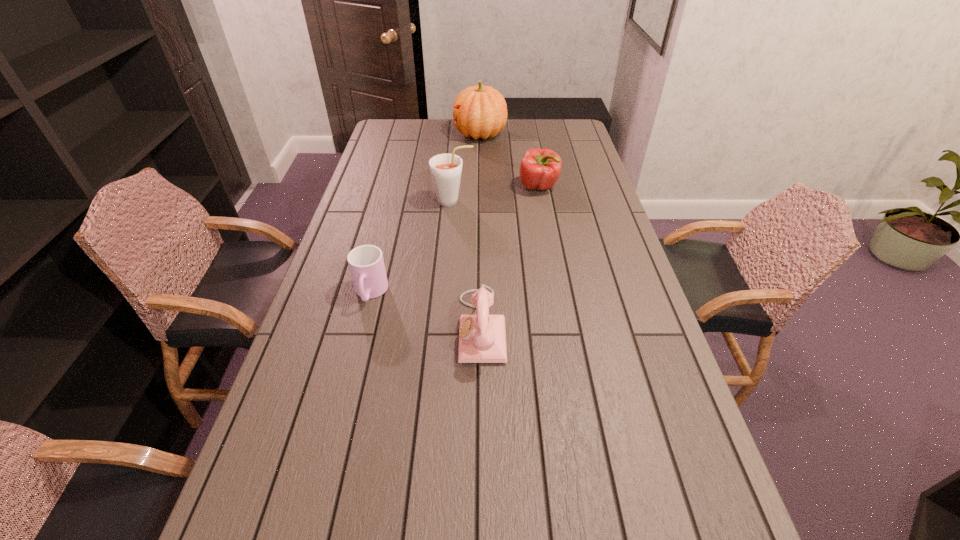
The width and height of the screenshot is (960, 540). In the image, there is a desktop. Find the location of `vacant space at the left edge`. vacant space at the left edge is located at coordinates (392, 187).

This screenshot has width=960, height=540. I want to click on blank space at the right edge of the desktop, so click(650, 525).

At what (x,y) coordinates should I click in order to perform the action: click on free spot between the root beer and the leftmost object. Please return your answer as a coordinate pair (x, y). Looking at the image, I should click on (412, 247).

Locate an element on the screen. The height and width of the screenshot is (540, 960). vacant space that is in between the pumpkin and the root beer is located at coordinates (467, 168).

The width and height of the screenshot is (960, 540). Find the location of `free space that is in between the telephone and the tallest object`. free space that is in between the telephone and the tallest object is located at coordinates (481, 230).

Locate an element on the screen. free spot between the second tallest object and the telephone is located at coordinates (468, 264).

Locate an element on the screen. vacant region between the telephone and the leftmost object is located at coordinates (426, 309).

Locate an element on the screen. The image size is (960, 540). vacant region between the shortest object and the telephone is located at coordinates (426, 309).

Locate an element on the screen. Image resolution: width=960 pixels, height=540 pixels. blank region between the root beer and the leftmost object is located at coordinates (412, 247).

Where is `free space between the telephone and the root beer`? Image resolution: width=960 pixels, height=540 pixels. free space between the telephone and the root beer is located at coordinates (468, 264).